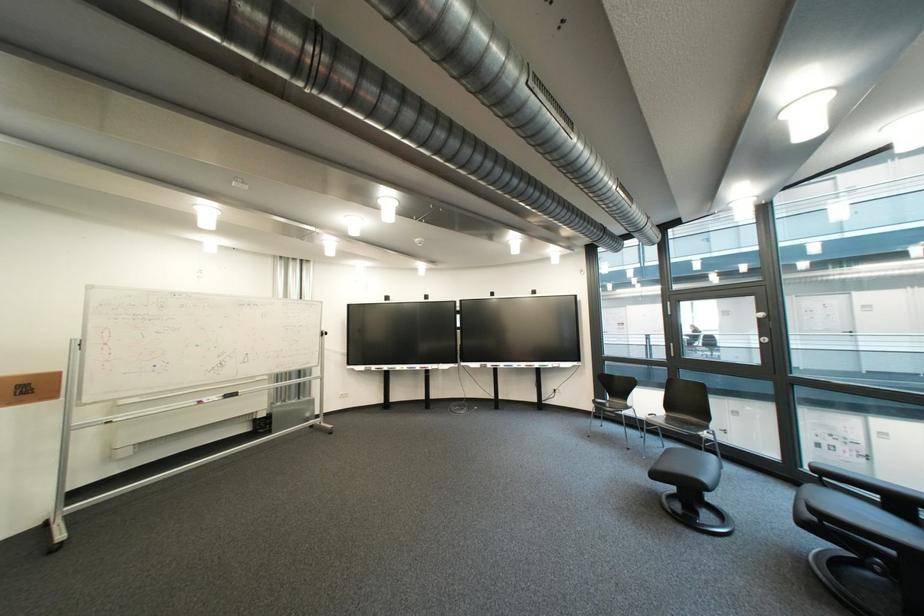
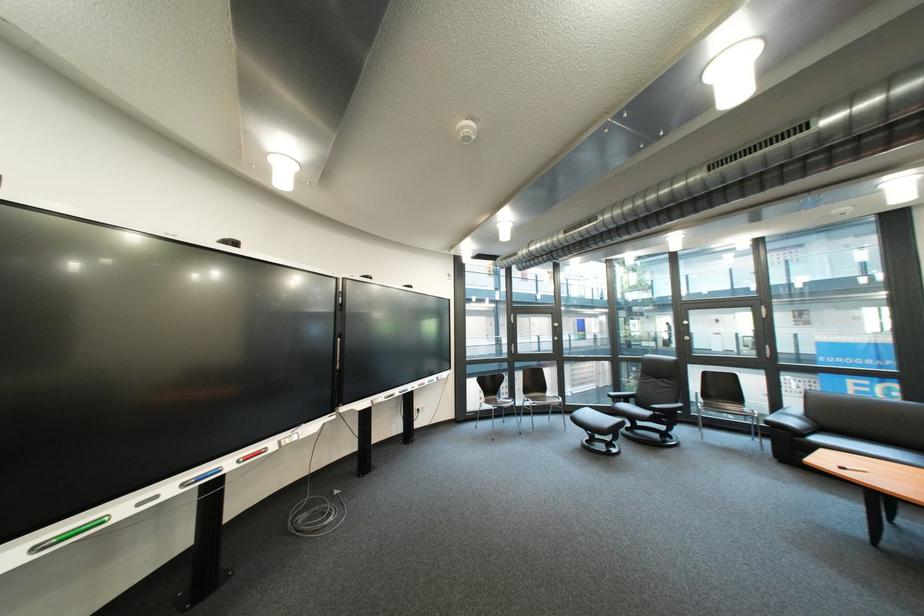
The point at (655, 439) is marked in the first image. Where is the corresponding point in the second image?

(517, 424)